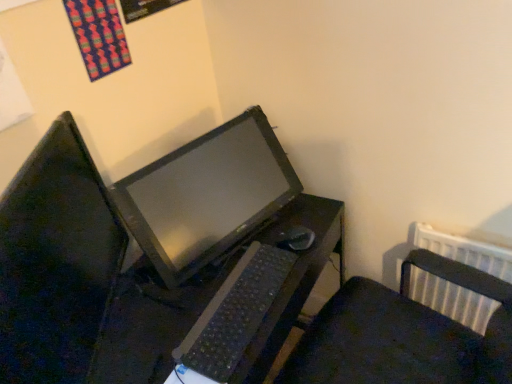
The image size is (512, 384). Identify the location of empty space that is ontop of black plastic keyboard at center. pos(232,297).